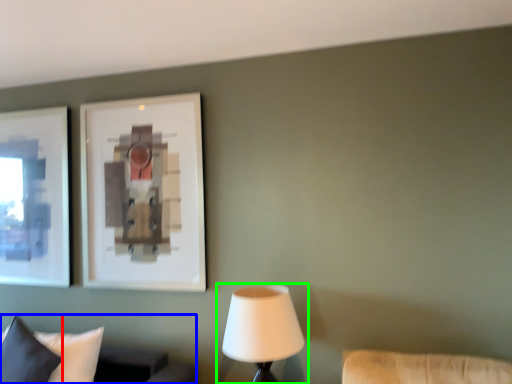
Question: Considering the real-world distances, which object is farthest from pillow (highlighted by a red box)? furniture (highlighted by a blue box) or lamp (highlighted by a green box)?

Choices:
 (A) furniture
 (B) lamp

Answer: (B)